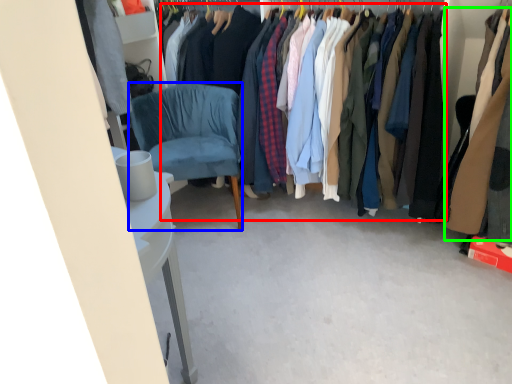
Question: Considering the real-world distances, which object is farthest from clothing (highlighted by a red box)? chair (highlighted by a blue box) or clothing (highlighted by a green box)?

Choices:
 (A) chair
 (B) clothing

Answer: (A)